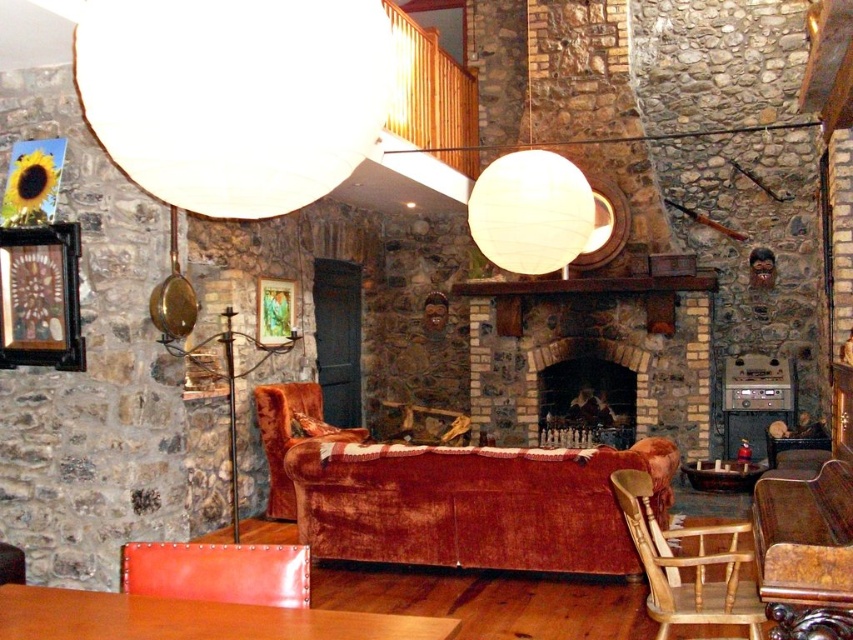
Question: Does white paper lampshade at upper center have a greater width compared to dark brown stone fireplace at center?

Choices:
 (A) yes
 (B) no

Answer: (B)

Question: Among these objects, which one is farthest from the camera?

Choices:
 (A) velvet brown armchair at center
 (B) brick fireplace at center

Answer: (B)

Question: Which of the following is the closest to the observer?

Choices:
 (A) dark brown stone fireplace at center
 (B) white matte sphere at upper center

Answer: (B)

Question: Which object is closer to the camera taking this photo?

Choices:
 (A) smooth brown table at lower center
 (B) metallic gold picture frame at upper center
 (C) white paper lampshade at upper center

Answer: (A)

Question: Does white matte sphere at upper center appear under wooden framed picture at left?

Choices:
 (A) no
 (B) yes

Answer: (A)

Question: In this image, where is white matte sphere at upper center located relative to dark brown stone fireplace at center?

Choices:
 (A) left
 (B) right

Answer: (A)